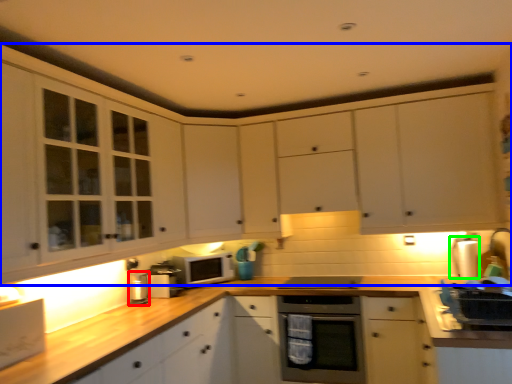
Question: Based on their relative distances, which object is farther from appliance (highlighted by a red box)? Choose from cabinetry (highlighted by a blue box) and appliance (highlighted by a green box).

Choices:
 (A) cabinetry
 (B) appliance

Answer: (B)